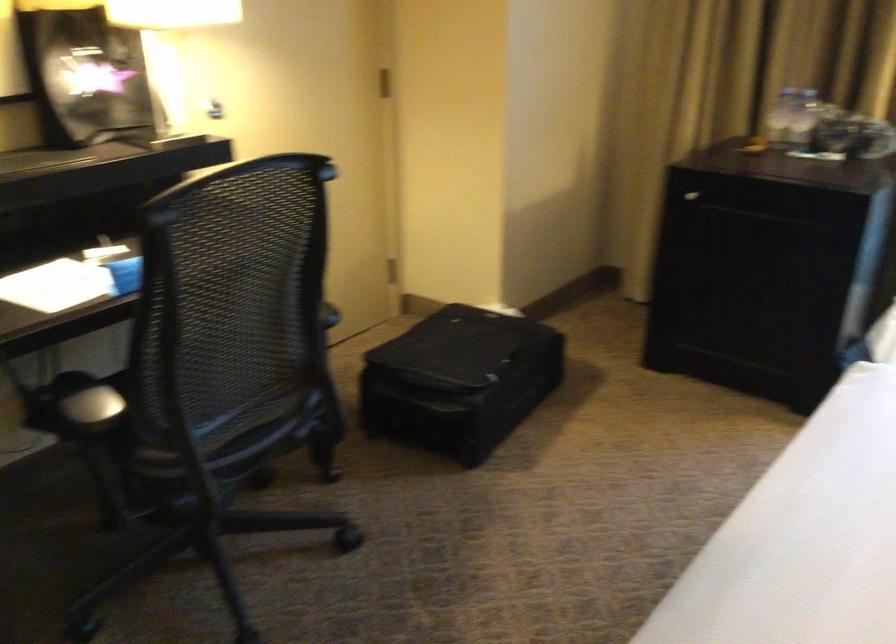
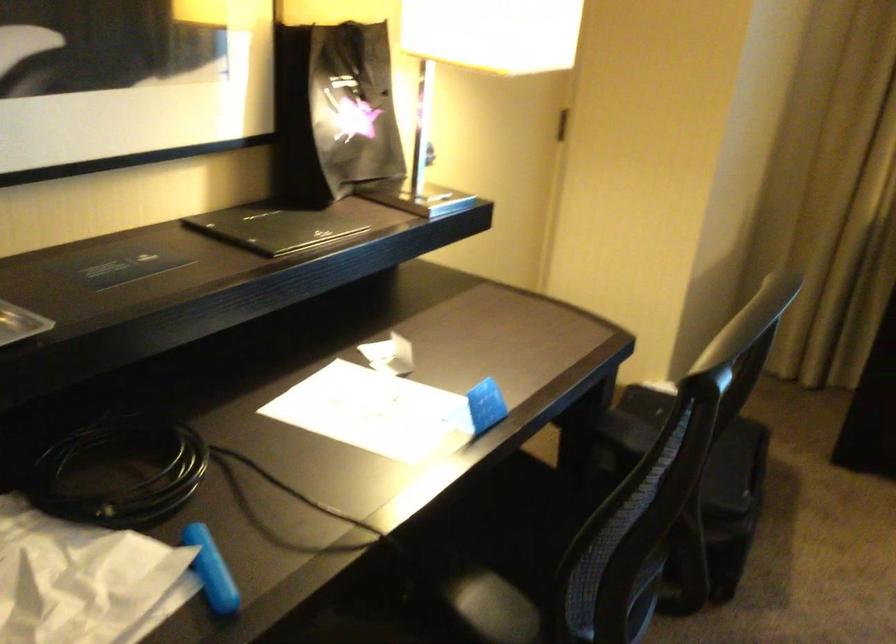
Locate, in the second image, the point that corresponds to point (453, 480) in the first image.

(709, 618)